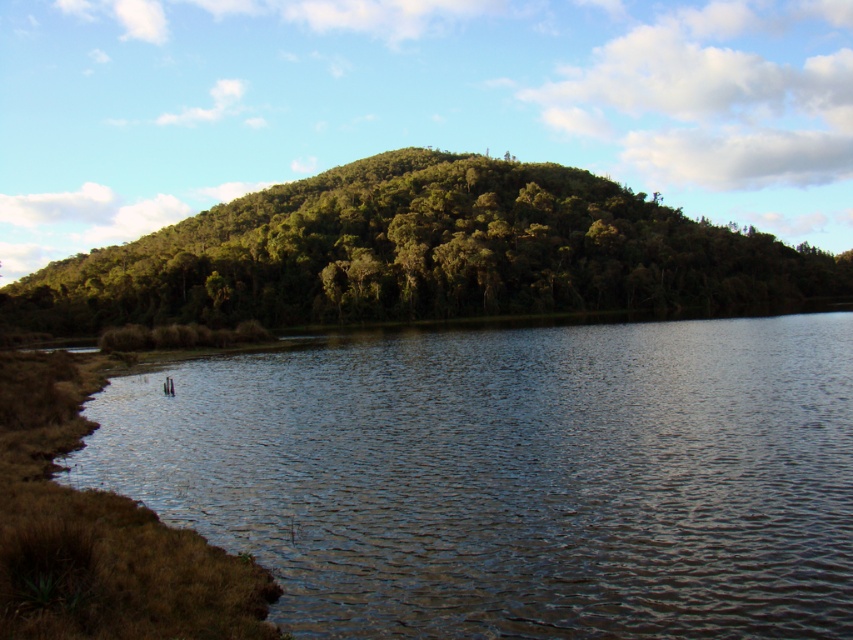
You are standing at the edge of the clear water at lower left and want to walk to the green leafy trees at center. Which direction should you head towards?

You should head towards the center direction because the green leafy trees at center are located in that direction from the clear water at lower left.

You are standing at the base of the large green hill and want to reach the top. You notice two points marked on the hillside. Which point, point [775,564] or point [340,276], is closer to your current position?

Point [775,564] is closer to the viewer than point [340,276], so the closer point to your current position is point [775,564].